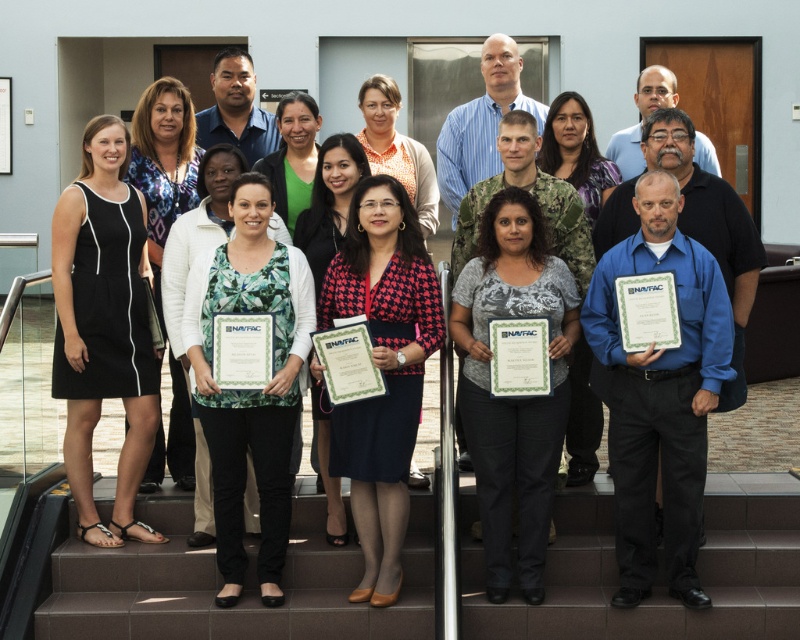
Does brown tile stairs at lower center have a larger size compared to gray matte shirt at center?

Actually, brown tile stairs at lower center might be smaller than gray matte shirt at center.

Does brown tile stairs at lower center appear on the right side of gray matte shirt at center?

In fact, brown tile stairs at lower center is to the left of gray matte shirt at center.

At what (x,y) coordinates should I click in order to perform the action: click on brown tile stairs at lower center. Please return your answer as a coordinate pair (x, y). The height and width of the screenshot is (640, 800). Looking at the image, I should click on (244, 589).

Identify the location of brown tile stairs at lower center. This screenshot has height=640, width=800. (244, 589).

Is brown tile stairs at lower center smaller than houndstooth fabric blazer at center?

Yes, brown tile stairs at lower center is smaller than houndstooth fabric blazer at center.

Is brown tile stairs at lower center taller than houndstooth fabric blazer at center?

In fact, brown tile stairs at lower center may be shorter than houndstooth fabric blazer at center.

Does point (724, 515) come behind point (368, 534)?

Yes.

At what (x,y) coordinates should I click in order to perform the action: click on brown tile stairs at lower center. Please return your answer as a coordinate pair (x, y). Looking at the image, I should click on click(244, 589).

Which is behind, point (62, 374) or point (397, 464)?

Positioned behind is point (62, 374).

Does black sleeveless dress at left come in front of houndstooth fabric blazer at center?

No, it is not.

What do you see at coordinates (104, 326) in the screenshot? I see `black sleeveless dress at left` at bounding box center [104, 326].

Identify the location of black sleeveless dress at left. This screenshot has width=800, height=640. 104,326.